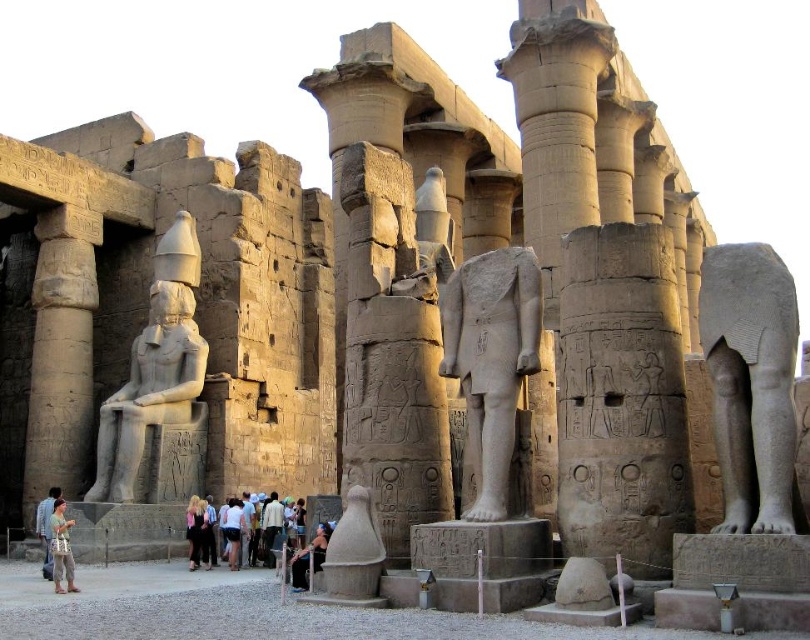
You are an archaeologist standing at the entrance of the Luxor Temple complex. You see the smooth stone column at center and the polished stone statue at center. You need to place a 35 meter long protective barrier between them. Is there enough space to place it?

The distance between the smooth stone column at center and the polished stone statue at center is 34.23 meters. Since the barrier is 35 meters long, it is slightly longer than the available space. Therefore, the barrier cannot be placed between them.

Consider the image. You are an archaeologist examining the Luxor Temple ruins. You notice two points marked on your map at coordinates point (126, 440) and point (241, 500). If you were to walk from the first point to the second, would you be moving closer to or further away from the seated statue of the pharaoh?

Moving from point (126, 440) to point (241, 500) would take you further away from the seated statue of the pharaoh because point (126, 440) is closer to the statue than point (241, 500).

You are an archaeologist standing in the Luxor Temple complex. You see the polished stone statue at center and the white cotton shirt at center. Which object is positioned to the left?

The polished stone statue at center is to the left of the white cotton shirt at center.